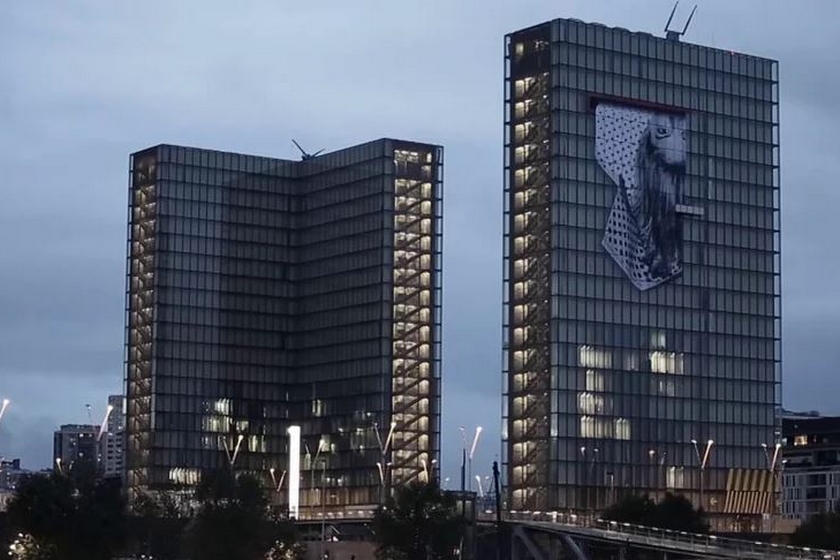
Where is `light on inside building`? The height and width of the screenshot is (560, 840). light on inside building is located at coordinates (528, 169).